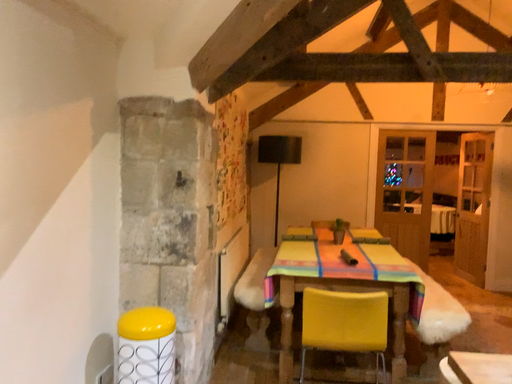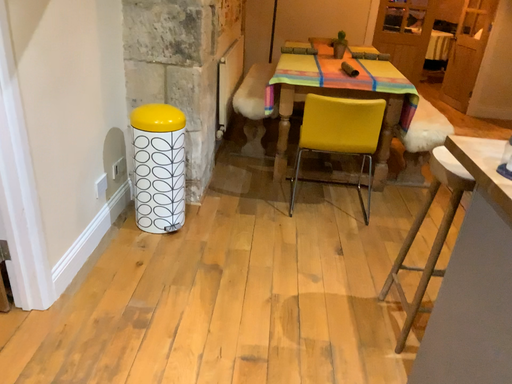
Question: Which way did the camera rotate in the video?

Choices:
 (A) rotated downward
 (B) rotated upward

Answer: (A)